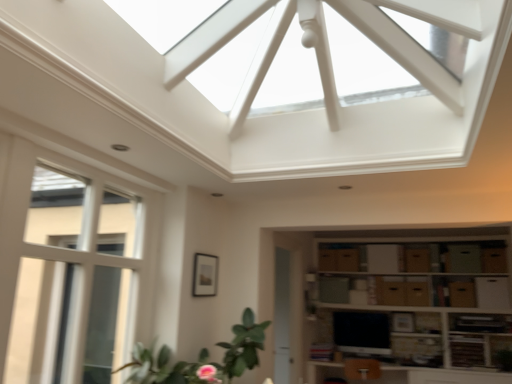
Locate an element on the screen. green leafy plant at lower left is located at coordinates (200, 359).

This screenshot has width=512, height=384. I want to click on brown cardboard drawer at lower right, the sixth drawer positioned from the left, so click(x=494, y=260).

What is the approximate height of brown cardboard drawer at center, the third drawer in the left-to-right sequence?

It is 8.82 inches.

The width and height of the screenshot is (512, 384). Describe the element at coordinates (417, 293) in the screenshot. I see `brown cardboard drawer at center, the third drawer in the left-to-right sequence` at that location.

What do you see at coordinates (339, 260) in the screenshot? I see `brown cardboard drawer at center, the 1th drawer positioned from the left` at bounding box center [339, 260].

Where is `green leafy plant at lower left`? This screenshot has width=512, height=384. green leafy plant at lower left is located at coordinates pyautogui.click(x=200, y=359).

How different are the orientations of matte black tv at lower center and brown cardboard boxes at lower right in degrees?

matte black tv at lower center and brown cardboard boxes at lower right are facing 1.89 degrees away from each other.

From a real-world perspective, is matte black tv at lower center on brown cardboard boxes at lower right?

No, from a real-world perspective, matte black tv at lower center is not over brown cardboard boxes at lower right

In the scene shown: From the image's perspective, is matte black tv at lower center under brown cardboard boxes at lower right?

Indeed, from the image's perspective, matte black tv at lower center is shown beneath brown cardboard boxes at lower right.

Find the location of a particular element. The width and height of the screenshot is (512, 384). drawer that is the 4th one when counting rightward from the matte black tv at lower center is located at coordinates (462, 294).

Based on their sizes in the image, would you say brown cardboard drawer at lower right, the 5th drawer in the left-to-right sequence, is bigger or smaller than matte black tv at lower center?

In the image, brown cardboard drawer at lower right, the 5th drawer in the left-to-right sequence, appears to be smaller than matte black tv at lower center.

Is brown cardboard drawer at lower right, arranged as the second drawer when viewed from the right, not inside matte black tv at lower center?

brown cardboard drawer at lower right, arranged as the second drawer when viewed from the right, is positioned outside matte black tv at lower center.

Is brown cardboard drawer at lower right, arranged as the second drawer when viewed from the right, oriented towards matte black tv at lower center?

No, brown cardboard drawer at lower right, arranged as the second drawer when viewed from the right, is not facing towards matte black tv at lower center.

From a real-world perspective, is brown cardboard drawer at center, placed as the sixth drawer when sorted from right to left, positioned over brown cardboard drawer at center-right, which appears as the 4th drawer when viewed from the left, based on gravity?

Yes.

Does brown cardboard drawer at center, the 1th drawer positioned from the left, turn towards brown cardboard drawer at center-right, which appears as the 4th drawer when viewed from the left?

No, brown cardboard drawer at center, the 1th drawer positioned from the left, does not turn towards brown cardboard drawer at center-right, which appears as the 4th drawer when viewed from the left.

Locate an element on the screen. drawer that is the 1st one when counting downward from the brown cardboard drawer at center-right, acting as the 3th drawer starting from the right (from the image's perspective) is located at coordinates (339, 260).

Does brown cardboard drawer at center, the 1th drawer positioned from the left, have a lesser width compared to brown cardboard drawer at center-right, which appears as the 4th drawer when viewed from the left?

Incorrect, the width of brown cardboard drawer at center, the 1th drawer positioned from the left, is not less than that of brown cardboard drawer at center-right, which appears as the 4th drawer when viewed from the left.

In the image, is brown cardboard boxes at lower right positioned in front of or behind white glass window at left?

Visually, brown cardboard boxes at lower right is located behind white glass window at left.

You are a GUI agent. You are given a task and a screenshot of the screen. Output one action in this format:
    pyautogui.click(x=<x>, y=<y>)
    Task: Click on the window above the brown cardboard boxes at lower right (from a real-world perspective)
    This screenshot has width=512, height=384.
    Given the screenshot: What is the action you would take?
    pyautogui.click(x=67, y=267)

Which of these two, brown cardboard boxes at lower right or white glass window at left, is bigger?

With larger size is brown cardboard boxes at lower right.

From a real-world perspective, is brown cardboard drawer at center, placed as the sixth drawer when sorted from right to left, on top of brown cardboard drawer at center, the second drawer in the left-to-right sequence?

Yes, from a real-world perspective, brown cardboard drawer at center, placed as the sixth drawer when sorted from right to left, is on top of brown cardboard drawer at center, the second drawer in the left-to-right sequence.

Would you say brown cardboard drawer at center, placed as the sixth drawer when sorted from right to left, contains brown cardboard drawer at center, the second drawer in the left-to-right sequence?

Definitely not — brown cardboard drawer at center, the second drawer in the left-to-right sequence, is not inside brown cardboard drawer at center, placed as the sixth drawer when sorted from right to left.

Identify the location of the 1st drawer in front when counting from the brown cardboard drawer at center, the 1th drawer positioned from the left. (392, 293).

Can you confirm if brown cardboard boxes at lower right is bigger than brown cardboard drawer at lower right, the 1th drawer when ordered from right to left?

Yes.

Is there a large distance between brown cardboard boxes at lower right and brown cardboard drawer at lower right, the sixth drawer positioned from the left?

brown cardboard boxes at lower right is near brown cardboard drawer at lower right, the sixth drawer positioned from the left, not far away.

Which object is further away from the camera taking this photo, brown cardboard boxes at lower right or brown cardboard drawer at lower right, the sixth drawer positioned from the left?

brown cardboard drawer at lower right, the sixth drawer positioned from the left, is further from the camera.

Is brown cardboard boxes at lower right to the right of brown cardboard drawer at lower right, the sixth drawer positioned from the left, from the viewer's perspective?

No, brown cardboard boxes at lower right is not to the right of brown cardboard drawer at lower right, the sixth drawer positioned from the left.

From the image's perspective, is brown cardboard drawer at center, placed as the sixth drawer when sorted from right to left, positioned above or below brown cardboard boxes at lower right?

From the image's perspective, brown cardboard drawer at center, placed as the sixth drawer when sorted from right to left, appears above brown cardboard boxes at lower right.

In the image, is brown cardboard drawer at center, the 1th drawer positioned from the left, on the left side or the right side of brown cardboard boxes at lower right?

brown cardboard drawer at center, the 1th drawer positioned from the left, is to the left of brown cardboard boxes at lower right.

Can you confirm if brown cardboard drawer at center, the 1th drawer positioned from the left, is smaller than brown cardboard boxes at lower right?

Correct, brown cardboard drawer at center, the 1th drawer positioned from the left, occupies less space than brown cardboard boxes at lower right.

Would you say brown cardboard drawer at center, the 1th drawer positioned from the left, contains brown cardboard boxes at lower right?

No, brown cardboard boxes at lower right is not a part of brown cardboard drawer at center, the 1th drawer positioned from the left.

Identify the location of shelf lying in front of the matte black tv at lower center. Image resolution: width=512 pixels, height=384 pixels. (411, 313).

Identify the location of the 3rd drawer directly above the matte black tv at lower center (from a real-world perspective). The width and height of the screenshot is (512, 384). (462, 294).

In the scene shown: From the image, which object appears to be farther from green leafy plant at lower left, brown cardboard drawer at center-right, which appears as the 4th drawer when viewed from the left, or brown cardboard drawer at lower right, arranged as the second drawer when viewed from the right?

brown cardboard drawer at lower right, arranged as the second drawer when viewed from the right, is further to green leafy plant at lower left.

Based on their spatial positions, is white glass window at left or brown cardboard drawer at center, which is the 4th drawer from right to left, further from brown cardboard drawer at center, placed as the sixth drawer when sorted from right to left?

Among the two, white glass window at left is located further to brown cardboard drawer at center, placed as the sixth drawer when sorted from right to left.

When comparing their distances from white glass window at left, does brown cardboard drawer at center-right, acting as the 3th drawer starting from the right, or brown cardboard drawer at center, the fifth drawer positioned from the right, seem further?

brown cardboard drawer at center-right, acting as the 3th drawer starting from the right, is further to white glass window at left.

Considering their positions, is white glass window at left positioned closer to brown cardboard drawer at center-right, acting as the 3th drawer starting from the right, than brown cardboard boxes at lower right?

brown cardboard boxes at lower right.

Estimate the real-world distances between objects in this image. Which object is closer to brown cardboard drawer at center, the 1th drawer positioned from the left, green leafy plant at lower left or brown cardboard drawer at lower right, the sixth drawer positioned from the left?

brown cardboard drawer at lower right, the sixth drawer positioned from the left.

Looking at the image, which one is located closer to brown cardboard drawer at center, the second drawer in the left-to-right sequence, brown cardboard drawer at lower right, the sixth drawer positioned from the left, or brown cardboard drawer at center-right, which appears as the 4th drawer when viewed from the left?

brown cardboard drawer at center-right, which appears as the 4th drawer when viewed from the left.

Based on their spatial positions, is green leafy plant at lower left or white glass window at left further from brown cardboard drawer at center-right, which appears as the 4th drawer when viewed from the left?

The object further to brown cardboard drawer at center-right, which appears as the 4th drawer when viewed from the left, is white glass window at left.

Considering their positions, is brown cardboard drawer at lower right, the 5th drawer in the left-to-right sequence, positioned closer to brown cardboard drawer at center-right, which appears as the 4th drawer when viewed from the left, than matte black tv at lower center?

Based on the image, brown cardboard drawer at lower right, the 5th drawer in the left-to-right sequence, appears to be nearer to brown cardboard drawer at center-right, which appears as the 4th drawer when viewed from the left.

You are a GUI agent. You are given a task and a screenshot of the screen. Output one action in this format:
    pyautogui.click(x=<x>, y=<y>)
    Task: Click on the houseplant between white glass window at left and brown cardboard drawer at center, the third drawer in the left-to-right sequence, in the front-back direction
    The image size is (512, 384).
    Given the screenshot: What is the action you would take?
    pyautogui.click(x=200, y=359)

You are a GUI agent. You are given a task and a screenshot of the screen. Output one action in this format:
    pyautogui.click(x=<x>, y=<y>)
    Task: Click on the shelf between green leafy plant at lower left and brown cardboard drawer at lower right, the 5th drawer in the left-to-right sequence, in the horizontal direction
    
    Given the screenshot: What is the action you would take?
    pyautogui.click(x=411, y=313)

Where is `shelf situated between brown cardboard drawer at center, the fifth drawer positioned from the right, and brown cardboard drawer at lower right, arranged as the second drawer when viewed from the right, from left to right`? The height and width of the screenshot is (384, 512). shelf situated between brown cardboard drawer at center, the fifth drawer positioned from the right, and brown cardboard drawer at lower right, arranged as the second drawer when viewed from the right, from left to right is located at coordinates (411, 313).

The height and width of the screenshot is (384, 512). I want to click on shelf between white glass window at left and brown cardboard drawer at center, placed as the sixth drawer when sorted from right to left, in the front-back direction, so click(x=411, y=313).